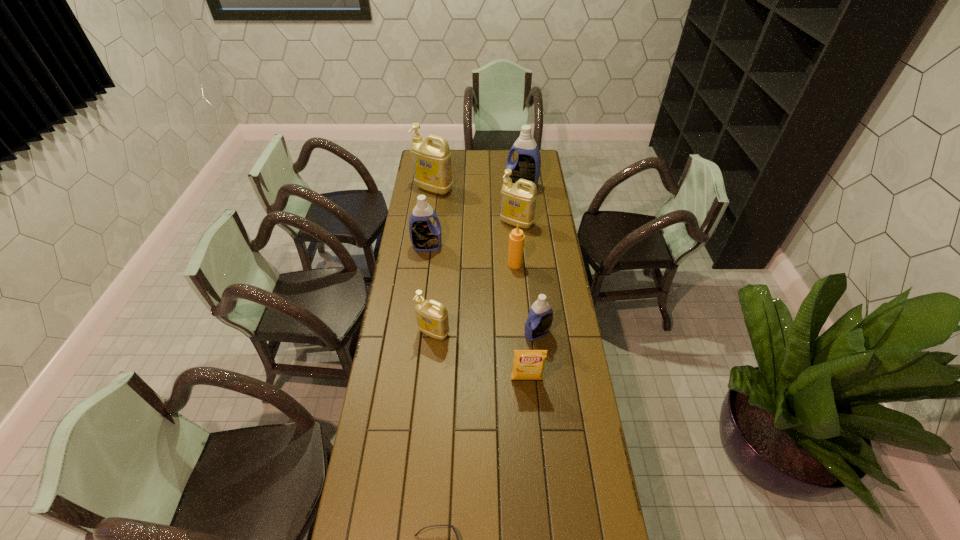
Select which object is the fourth closest to the smallest blue detergent. Please provide its 2D coordinates. Your answer should be formatted as a tuple, i.e. [(x, y)], where the tuple contains the x and y coordinates of a point satisfying the conditions above.

[(425, 236)]

Identify which object is the sixth nearest to the biggest beige detergent. Please provide its 2D coordinates. Your answer should be formatted as a tuple, i.e. [(x, y)], where the tuple contains the x and y coordinates of a point satisfying the conditions above.

[(539, 321)]

This screenshot has height=540, width=960. What are the coordinates of `detergent that is the third nearest to the eighth tallest object` in the screenshot? It's located at (425, 236).

Identify which detergent is the fourth nearest to the smallest blue detergent. Please provide its 2D coordinates. Your answer should be formatted as a tuple, i.e. [(x, y)], where the tuple contains the x and y coordinates of a point satisfying the conditions above.

[(527, 166)]

Identify which beige detergent is the second nearest to the farthest blue detergent. Please provide its 2D coordinates. Your answer should be formatted as a tuple, i.e. [(x, y)], where the tuple contains the x and y coordinates of a point satisfying the conditions above.

[(431, 161)]

Locate an element on the screen. The image size is (960, 540). beige detergent that is the third nearest to the tan condiment is located at coordinates (431, 161).

Point out which blue detergent is positioned as the second nearest to the condiment. Please provide its 2D coordinates. Your answer should be formatted as a tuple, i.e. [(x, y)], where the tuple contains the x and y coordinates of a point satisfying the conditions above.

[(539, 321)]

Locate an element on the screen. The height and width of the screenshot is (540, 960). blue detergent that is the closest to the smallest blue detergent is located at coordinates (425, 236).

Where is `free space that satisfies the following two spatial constraints: 1. on the back side of the farthest blue detergent; 2. on the left side of the biggest beige detergent`? The width and height of the screenshot is (960, 540). free space that satisfies the following two spatial constraints: 1. on the back side of the farthest blue detergent; 2. on the left side of the biggest beige detergent is located at coordinates (434, 187).